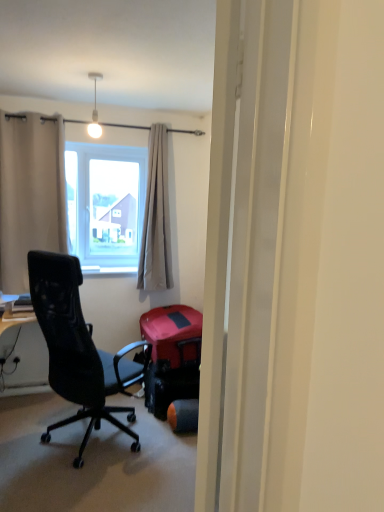
Describe the element at coordinates (106, 205) in the screenshot. I see `transparent glass window at center` at that location.

What do you see at coordinates (30, 194) in the screenshot? This screenshot has height=512, width=384. I see `beige fabric curtain at left, arranged as the 1th curtain when viewed from the left` at bounding box center [30, 194].

Identify the location of transparent glass window at center. (106, 205).

Which is more to the right, beige fabric curtain at left, placed as the second curtain when sorted from right to left, or transparent glass window at center?

From the viewer's perspective, transparent glass window at center appears more on the right side.

Does beige fabric curtain at left, placed as the second curtain when sorted from right to left, have a smaller size compared to transparent glass window at center?

Actually, beige fabric curtain at left, placed as the second curtain when sorted from right to left, might be larger than transparent glass window at center.

Is beige fabric curtain at left, arranged as the 1th curtain when viewed from the left, spatially inside transparent glass window at center, or outside of it?

beige fabric curtain at left, arranged as the 1th curtain when viewed from the left, lies outside transparent glass window at center.

From a real-world perspective, is beige fabric curtain at left, arranged as the 1th curtain when viewed from the left, positioned above or below transparent glass window at center?

beige fabric curtain at left, arranged as the 1th curtain when viewed from the left, is above transparent glass window at center.

Looking at this image, which object is further away from the camera taking this photo, white glossy light bulb at upper center or light beige fabric curtain at center, which appears as the 1th curtain when viewed from the right?

Positioned behind is light beige fabric curtain at center, which appears as the 1th curtain when viewed from the right.

From the image's perspective, which one is positioned higher, white glossy light bulb at upper center or light beige fabric curtain at center, the second curtain positioned from the left?

white glossy light bulb at upper center appears higher in the image.

Which object is thinner, white glossy light bulb at upper center or light beige fabric curtain at center, which appears as the 1th curtain when viewed from the right?

white glossy light bulb at upper center is thinner.

Can you confirm if white glossy light bulb at upper center is positioned to the right of light beige fabric curtain at center, which appears as the 1th curtain when viewed from the right?

Incorrect, white glossy light bulb at upper center is not on the right side of light beige fabric curtain at center, which appears as the 1th curtain when viewed from the right.

Relative to white glossy light bulb at upper center, is transparent glass window at center in front or behind?

transparent glass window at center is positioned farther from the viewer than white glossy light bulb at upper center.

Consider the image. Considering the sizes of transparent glass window at center and white glossy light bulb at upper center in the image, is transparent glass window at center taller or shorter than white glossy light bulb at upper center?

transparent glass window at center is taller than white glossy light bulb at upper center.

Is white glossy light bulb at upper center at the back of transparent glass window at center?

No.

Who is bigger, transparent glass window at center or white glossy light bulb at upper center?

transparent glass window at center.

Which object is thinner, white glossy light bulb at upper center or beige fabric curtain at left, placed as the second curtain when sorted from right to left?

white glossy light bulb at upper center is thinner.

Could you tell me if white glossy light bulb at upper center is facing beige fabric curtain at left, arranged as the 1th curtain when viewed from the left?

No, white glossy light bulb at upper center is not turned towards beige fabric curtain at left, arranged as the 1th curtain when viewed from the left.

From a real-world perspective, which is physically below, white glossy light bulb at upper center or beige fabric curtain at left, placed as the second curtain when sorted from right to left?

beige fabric curtain at left, placed as the second curtain when sorted from right to left.

Consider the image. Does white glossy light bulb at upper center have a smaller size compared to beige fabric curtain at left, placed as the second curtain when sorted from right to left?

Yes.

Which is in front, light beige fabric curtain at center, the second curtain positioned from the left, or beige fabric curtain at left, arranged as the 1th curtain when viewed from the left?

beige fabric curtain at left, arranged as the 1th curtain when viewed from the left, is more forward.

Measure the distance between light beige fabric curtain at center, which appears as the 1th curtain when viewed from the right, and beige fabric curtain at left, arranged as the 1th curtain when viewed from the left.

33.72 inches.

Considering the relative sizes of light beige fabric curtain at center, which appears as the 1th curtain when viewed from the right, and beige fabric curtain at left, placed as the second curtain when sorted from right to left, in the image provided, is light beige fabric curtain at center, which appears as the 1th curtain when viewed from the right, bigger than beige fabric curtain at left, placed as the second curtain when sorted from right to left,?

Actually, light beige fabric curtain at center, which appears as the 1th curtain when viewed from the right, might be smaller than beige fabric curtain at left, placed as the second curtain when sorted from right to left.

Can you confirm if transparent glass window at center is positioned to the left of light beige fabric curtain at center, which appears as the 1th curtain when viewed from the right?

Yes.

Is light beige fabric curtain at center, the second curtain positioned from the left, at the back of transparent glass window at center?

No.

Does point (102, 232) come closer to viewer compared to point (165, 239)?

No, (102, 232) is behind (165, 239).

Considering the sizes of transparent glass window at center and light beige fabric curtain at center, which appears as the 1th curtain when viewed from the right, in the image, is transparent glass window at center bigger or smaller than light beige fabric curtain at center, which appears as the 1th curtain when viewed from the right,?

transparent glass window at center is smaller than light beige fabric curtain at center, which appears as the 1th curtain when viewed from the right.

Is transparent plastic screen door at center located within rubberized red suitcase at center?

No, transparent plastic screen door at center is not surrounded by rubberized red suitcase at center.

Does rubberized red suitcase at center lie in front of transparent plastic screen door at center?

No, the depth of rubberized red suitcase at center is greater than that of transparent plastic screen door at center.

Is rubberized red suitcase at center oriented away from transparent plastic screen door at center?

rubberized red suitcase at center does not have its back to transparent plastic screen door at center.

From a real-world perspective, between rubberized red suitcase at center and transparent plastic screen door at center, who is vertically higher?

From a 3D spatial view, transparent plastic screen door at center is above.

Find the location of a particular element. window located behind the beige fabric curtain at left, arranged as the 1th curtain when viewed from the left is located at coordinates (106, 205).

From the image's perspective, which curtain is the 2nd one below the white glossy light bulb at upper center? Please provide its 2D coordinates.

[(156, 218)]

From the image, which object appears to be nearer to rubberized red suitcase at center, transparent glass window at center or white glossy light bulb at upper center?

Among the two, transparent glass window at center is located nearer to rubberized red suitcase at center.

Considering their positions, is white glossy light bulb at upper center positioned closer to transparent plastic screen door at center than transparent glass window at center?

The object closer to transparent plastic screen door at center is white glossy light bulb at upper center.

From the image, which object appears to be farther from beige fabric curtain at left, placed as the second curtain when sorted from right to left, transparent glass window at center or white glossy light bulb at upper center?

Based on the image, white glossy light bulb at upper center appears to be further to beige fabric curtain at left, placed as the second curtain when sorted from right to left.

Estimate the real-world distances between objects in this image. Which object is closer to rubberized red suitcase at center, transparent plastic screen door at center or white glossy light bulb at upper center?

white glossy light bulb at upper center is positioned closer to the anchor rubberized red suitcase at center.

Looking at this image, looking at the image, which one is located further to beige fabric curtain at left, placed as the second curtain when sorted from right to left, rubberized red suitcase at center or transparent glass window at center?

Among the two, rubberized red suitcase at center is located further to beige fabric curtain at left, placed as the second curtain when sorted from right to left.

Which object lies nearer to the anchor point white glossy light bulb at upper center, light beige fabric curtain at center, which appears as the 1th curtain when viewed from the right, or beige fabric curtain at left, placed as the second curtain when sorted from right to left?

beige fabric curtain at left, placed as the second curtain when sorted from right to left, lies closer to white glossy light bulb at upper center than the other object.

Considering their positions, is beige fabric curtain at left, placed as the second curtain when sorted from right to left, positioned further to white glossy light bulb at upper center than rubberized red suitcase at center?

rubberized red suitcase at center lies further to white glossy light bulb at upper center than the other object.

Estimate the real-world distances between objects in this image. Which object is further from transparent glass window at center, beige fabric curtain at left, placed as the second curtain when sorted from right to left, or rubberized red suitcase at center?

rubberized red suitcase at center is further to transparent glass window at center.

Find the location of a particular element. This screenshot has width=384, height=512. curtain between beige fabric curtain at left, arranged as the 1th curtain when viewed from the left, and rubberized red suitcase at center from top to bottom is located at coordinates (156, 218).

The height and width of the screenshot is (512, 384). Identify the location of window between beige fabric curtain at left, placed as the second curtain when sorted from right to left, and rubberized red suitcase at center in the up-down direction. (106, 205).

I want to click on lamp between beige fabric curtain at left, placed as the second curtain when sorted from right to left, and light beige fabric curtain at center, which appears as the 1th curtain when viewed from the right, so (94, 110).

The height and width of the screenshot is (512, 384). What are the coordinates of `lamp between transparent plastic screen door at center and beige fabric curtain at left, arranged as the 1th curtain when viewed from the left, from front to back` in the screenshot? It's located at (94, 110).